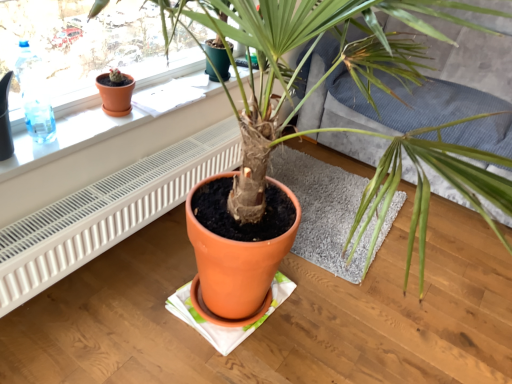
Question: From a real-world perspective, is white plastic radiator at lower left on top of terracotta pot at center?

Choices:
 (A) no
 (B) yes

Answer: (A)

Question: Is white plastic radiator at lower left thinner than terracotta pot at center?

Choices:
 (A) yes
 (B) no

Answer: (A)

Question: Is white plastic radiator at lower left smaller than terracotta pot at center?

Choices:
 (A) no
 (B) yes

Answer: (B)

Question: Is white plastic radiator at lower left completely or partially outside of terracotta pot at center?

Choices:
 (A) yes
 (B) no

Answer: (B)

Question: Is the surface of white plastic radiator at lower left in direct contact with terracotta pot at center?

Choices:
 (A) yes
 (B) no

Answer: (B)

Question: Is white plastic radiator at lower left to the left of terracotta pot at center from the viewer's perspective?

Choices:
 (A) yes
 (B) no

Answer: (A)

Question: Is matte orange flowerpot at upper left outside transparent plastic bottle at upper left?

Choices:
 (A) yes
 (B) no

Answer: (A)

Question: From the image's perspective, is matte orange flowerpot at upper left on top of transparent plastic bottle at upper left?

Choices:
 (A) yes
 (B) no

Answer: (A)

Question: Could transparent plastic bottle at upper left be considered to be inside matte orange flowerpot at upper left?

Choices:
 (A) no
 (B) yes

Answer: (A)

Question: From the image's perspective, is matte orange flowerpot at upper left under transparent plastic bottle at upper left?

Choices:
 (A) yes
 (B) no

Answer: (B)

Question: Can you confirm if matte orange flowerpot at upper left is shorter than transparent plastic bottle at upper left?

Choices:
 (A) yes
 (B) no

Answer: (A)

Question: From a real-world perspective, is matte orange flowerpot at upper left beneath transparent plastic bottle at upper left?

Choices:
 (A) no
 (B) yes

Answer: (B)

Question: Can you confirm if textured gray couch at center is positioned to the left of terracotta pot at upper left?

Choices:
 (A) yes
 (B) no

Answer: (B)